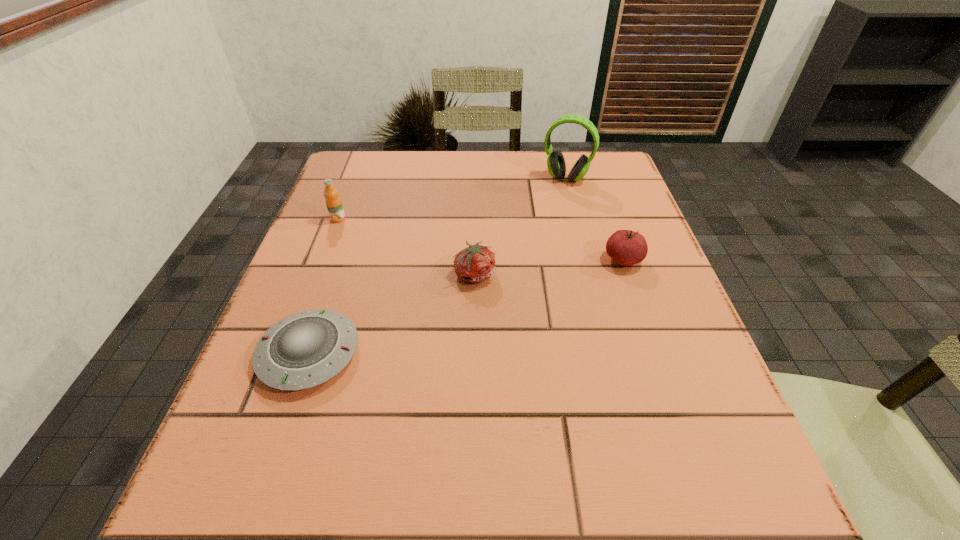
Identify the location of empty space that is in between the third object from right to left and the right tomato. (549, 267).

Identify the location of free spot between the third object from left to right and the farthest object. The height and width of the screenshot is (540, 960). (520, 226).

I want to click on free point between the tallest object and the nearest object, so click(438, 266).

Find the location of a particular element. The height and width of the screenshot is (540, 960). vacant space that is in between the saucer and the second tallest object is located at coordinates pyautogui.click(x=324, y=286).

Find the location of a particular element. Image resolution: width=960 pixels, height=540 pixels. vacant point located between the orange juice and the shortest object is located at coordinates (324, 286).

Find the location of a particular element. the second closest object to the second tallest object is located at coordinates (476, 263).

You are a GUI agent. You are given a task and a screenshot of the screen. Output one action in this format:
    pyautogui.click(x=<x>, y=<y>)
    Task: Click on the object that is the nearest to the left tomato
    
    Given the screenshot: What is the action you would take?
    pyautogui.click(x=308, y=348)

Where is `free spot that satisfies the following two spatial constraints: 1. on the front side of the right tomato; 2. on the right side of the farthest object`? free spot that satisfies the following two spatial constraints: 1. on the front side of the right tomato; 2. on the right side of the farthest object is located at coordinates (588, 260).

The image size is (960, 540). Identify the location of free space that satisfies the following two spatial constraints: 1. on the front side of the right tomato; 2. on the right side of the headset. (588, 260).

Locate an element on the screen. The image size is (960, 540). vacant area that satisfies the following two spatial constraints: 1. on the back side of the shortest object; 2. on the left side of the right tomato is located at coordinates (341, 260).